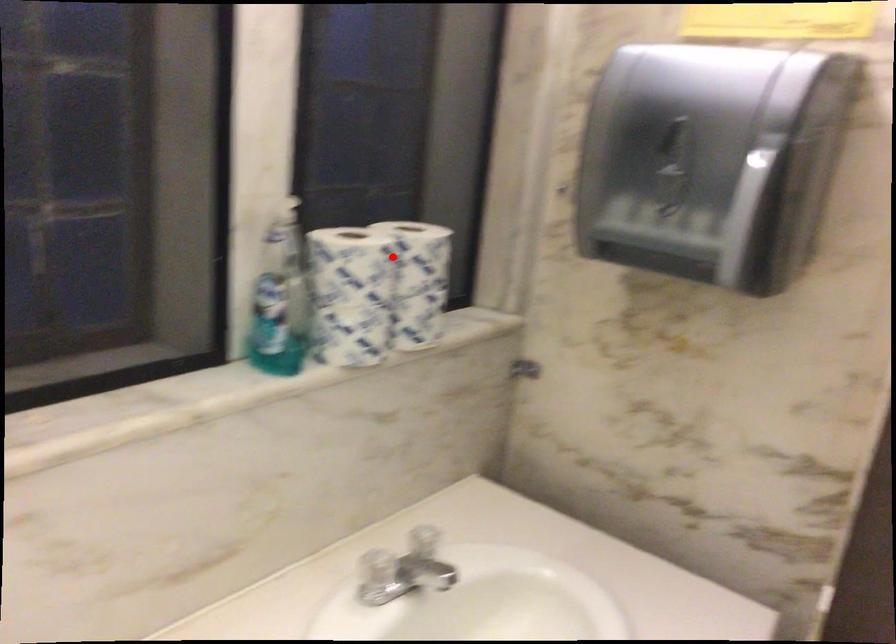
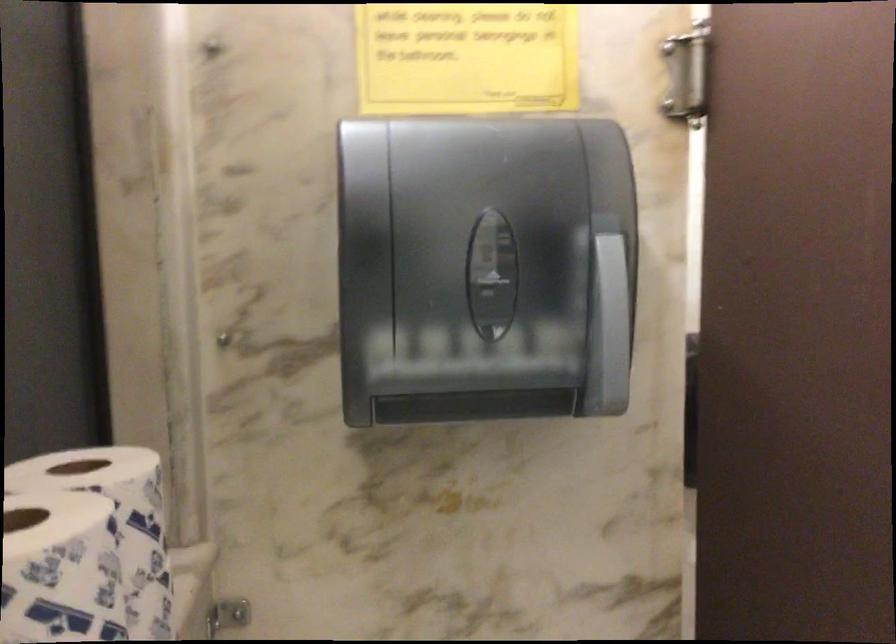
Question: I am providing you with two images of the same scene from different viewpoints. In image1, a red point is highlighted. Considering the same 3D point in image2, which of the following is correct?

Choices:
 (A) It is closer
 (B) It is farther

Answer: (A)